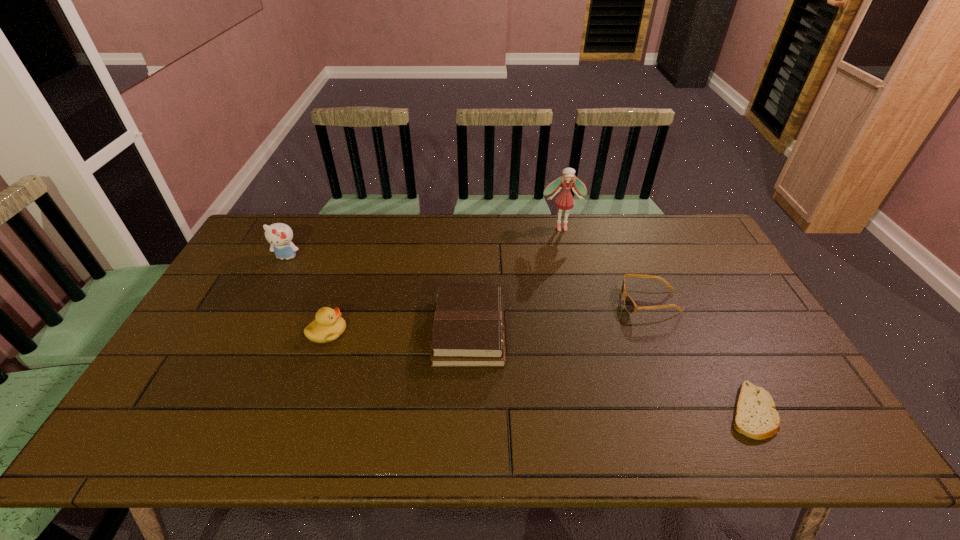
At what (x,y) coordinates should I click in order to perform the action: click on free space at the near left corner of the desktop. Please return your answer as a coordinate pair (x, y). This screenshot has height=540, width=960. Looking at the image, I should click on (184, 423).

Identify the location of vacant area between the fifth tallest object and the fourth object from left to right. (606, 265).

Find the location of a particular element. The image size is (960, 540). empty space that is in between the third object from right to left and the third object from left to right is located at coordinates (516, 279).

Where is `empty location between the sunglasses and the farthest object`? empty location between the sunglasses and the farthest object is located at coordinates (606, 265).

The width and height of the screenshot is (960, 540). Find the location of `empty space between the sunglasses and the second farthest object`. empty space between the sunglasses and the second farthest object is located at coordinates (468, 280).

Where is `free space between the tallest object and the duckling`? The width and height of the screenshot is (960, 540). free space between the tallest object and the duckling is located at coordinates (444, 280).

The height and width of the screenshot is (540, 960). I want to click on free space between the tallest object and the pita bread, so (657, 319).

This screenshot has width=960, height=540. Find the location of `free space between the third tallest object and the fourth tallest object`. free space between the third tallest object and the fourth tallest object is located at coordinates (398, 332).

Locate an element on the screen. free space between the shortest object and the third tallest object is located at coordinates (540, 372).

Where is `free space between the nearest object and the tallest object`? This screenshot has height=540, width=960. free space between the nearest object and the tallest object is located at coordinates (657, 319).